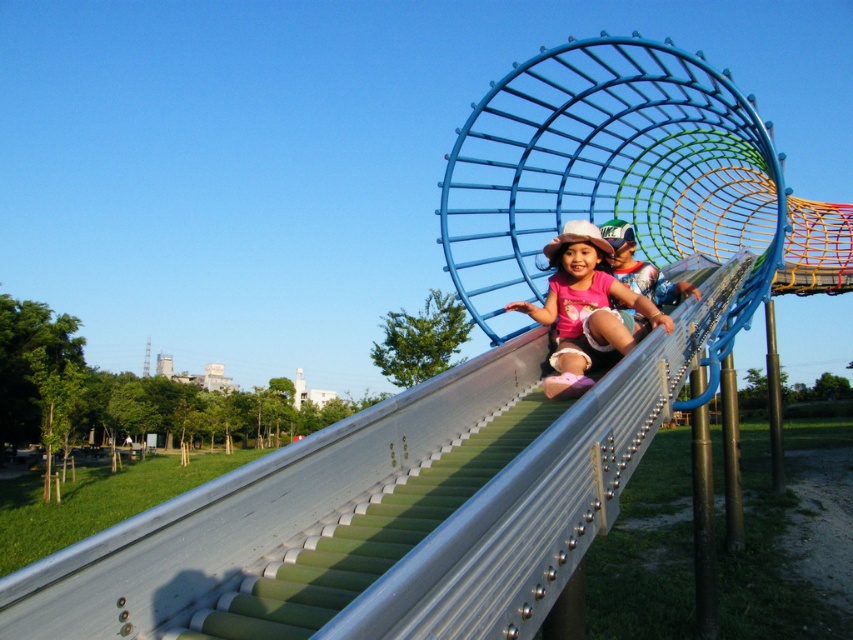
Question: Is pink fabric pants at center smaller than matte pink shirt at center?

Choices:
 (A) yes
 (B) no

Answer: (B)

Question: Is pink fabric pants at center above matte pink shirt at center?

Choices:
 (A) yes
 (B) no

Answer: (B)

Question: Which of the following is the closest to the observer?

Choices:
 (A) [x=573, y=381]
 (B) [x=627, y=221]

Answer: (A)

Question: Which of the following is the closest to the observer?

Choices:
 (A) pink fabric pants at center
 (B) matte pink shirt at center

Answer: (A)

Question: Does pink fabric pants at center appear on the right side of matte pink shirt at center?

Choices:
 (A) no
 (B) yes

Answer: (A)

Question: Which of the following is the closest to the observer?

Choices:
 (A) matte pink shirt at center
 (B) pink fabric pants at center

Answer: (B)